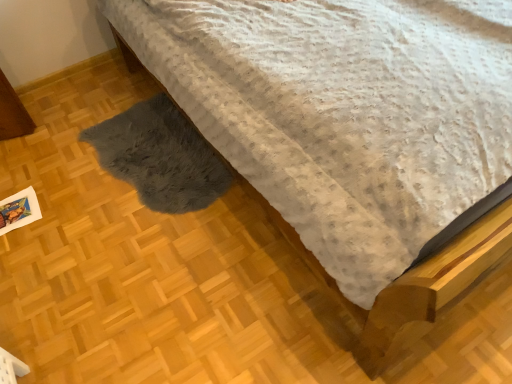
Identify the location of free space in front of gray furry mat at lower left. The image size is (512, 384). (144, 269).